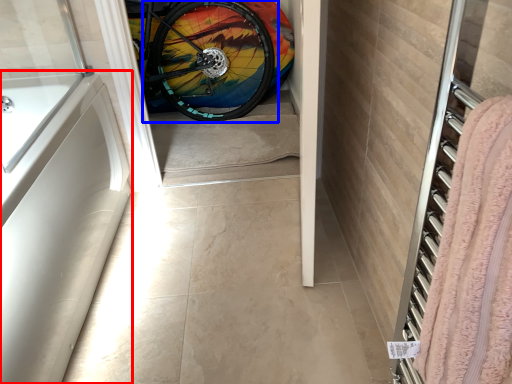
Question: Which point is further to the camera, bath (highlighted by a red box) or bicycle wheel (highlighted by a blue box)?

Choices:
 (A) bath
 (B) bicycle wheel

Answer: (B)